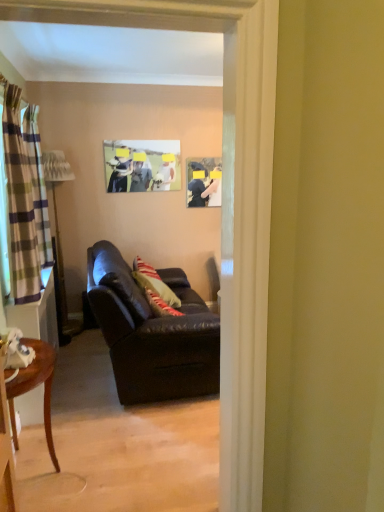
What are the coordinates of `blank area beneath mahogany wood side table at lower left (from a real-world perspective)` in the screenshot? It's located at (32, 475).